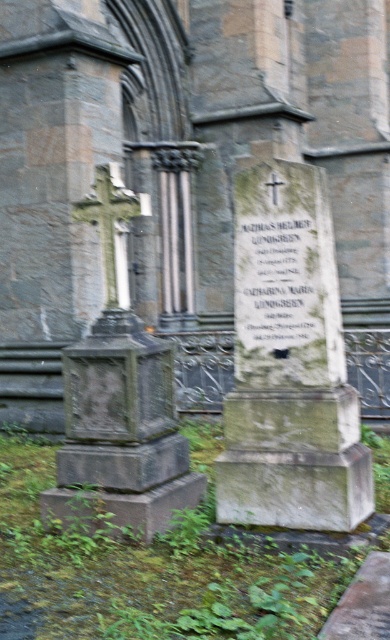
Question: Can you confirm if stone cross at center is positioned above granite cross at left?

Choices:
 (A) yes
 (B) no

Answer: (A)

Question: Is stone cross at center to the left of white stone inscription at center from the viewer's perspective?

Choices:
 (A) no
 (B) yes

Answer: (A)

Question: Estimate the real-world distances between objects in this image. Which object is farther from the stone cross at center?

Choices:
 (A) white stone inscription at center
 (B) granite cross at left

Answer: (B)

Question: Which point appears closest to the camera in this image?

Choices:
 (A) (303, 182)
 (B) (115, 16)
 (C) (251, 337)

Answer: (A)

Question: Which point is closer to the camera?

Choices:
 (A) white stone inscription at center
 (B) green stone gravestone at center

Answer: (B)

Question: Does stone cross at center appear on the left side of white stone inscription at center?

Choices:
 (A) no
 (B) yes

Answer: (A)